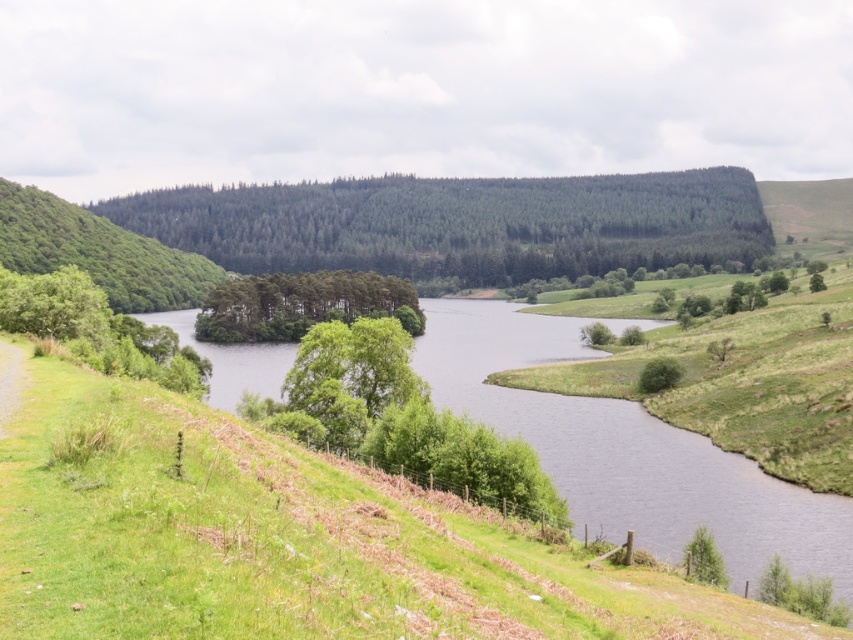
You are standing at the origin point of the coordinate system in the image. You want to walk to the green leafy trees at center. What are the coordinates you need to move to?

The coordinates you need to move to are approximately 0.477 in the x direction and 0.353 in the y direction, as the green leafy trees at center are located at point (300, 305).

You are a hiker standing on the grassy slope near the wooden fence. You see the green textured forest at center and the green matte tree at lower right. Which of these two is positioned higher up in the landscape?

The green textured forest at center is located above the green matte tree at lower right, so it is positioned higher up in the landscape.